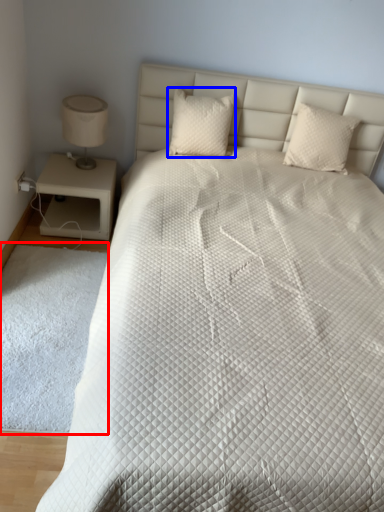
Question: Which of the following is the closest to the observer, mat (highlighted by a red box) or pillow (highlighted by a blue box)?

Choices:
 (A) mat
 (B) pillow

Answer: (A)